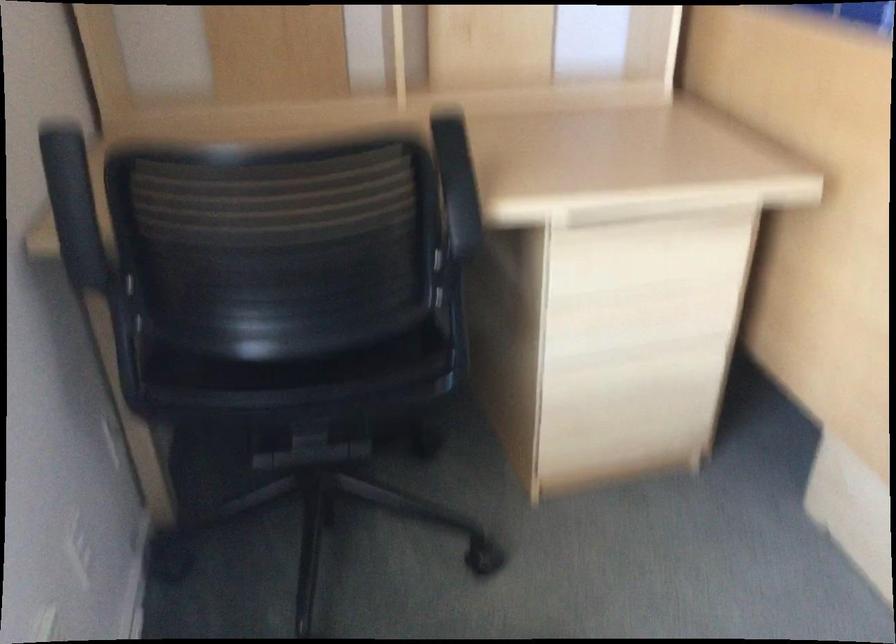
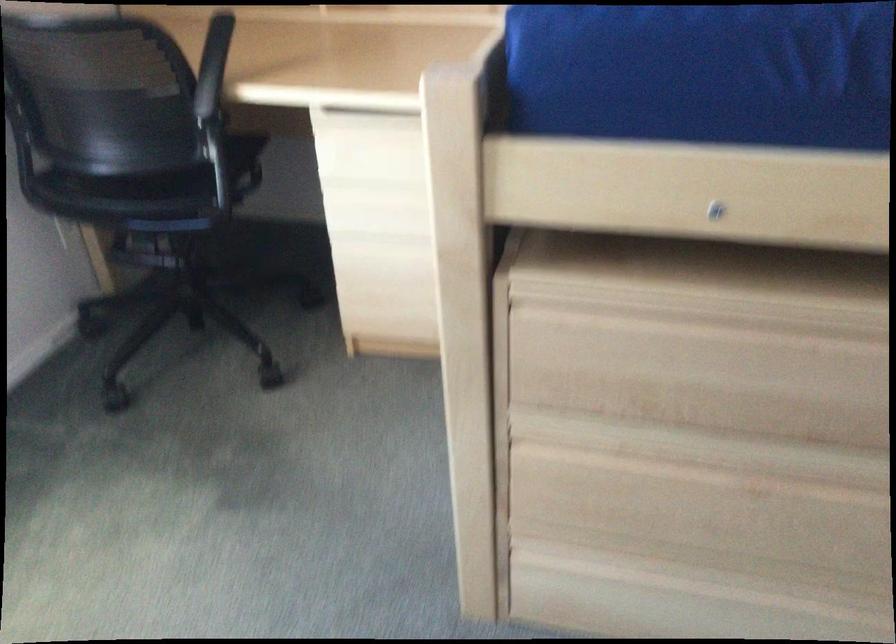
Locate, in the second image, the point that corresponds to point (618, 221) in the first image.

(364, 117)